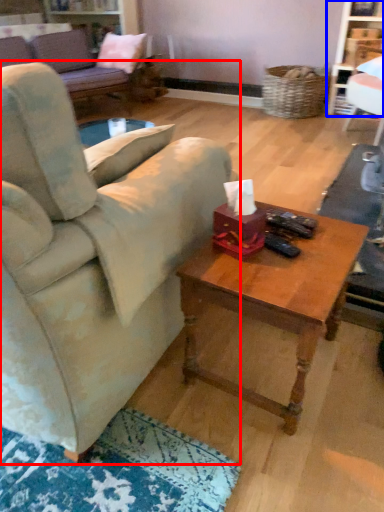
Question: Which object appears farthest to the camera in this image, studio couch (highlighted by a red box) or bookshelf (highlighted by a blue box)?

Choices:
 (A) studio couch
 (B) bookshelf

Answer: (B)